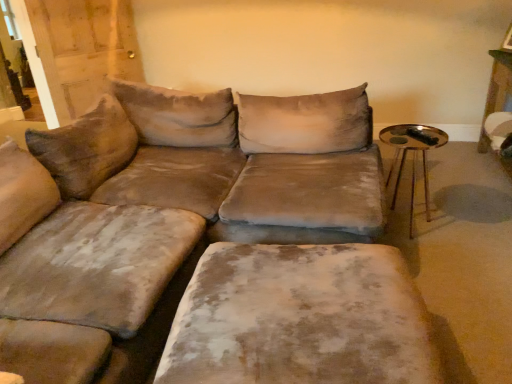
Identify the location of vacant region above velvet beige ottoman at center (from a real-world perspective). Image resolution: width=512 pixels, height=384 pixels. (309, 297).